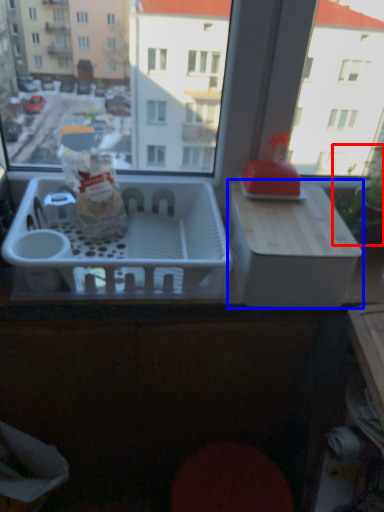
Question: Which point is further to the camera, plant (highlighted by a red box) or cardboard box (highlighted by a blue box)?

Choices:
 (A) plant
 (B) cardboard box

Answer: (A)